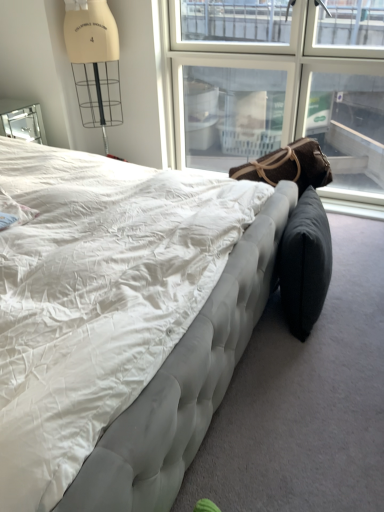
Question: Which direction should I rotate to look at brown fabric bean bag at center, the 1th bean bag chair viewed from the top?

Choices:
 (A) right
 (B) left

Answer: (A)

Question: From a real-world perspective, is brown fabric bean bag at center, the 1th bean bag chair viewed from the top, positioned over tufted fabric bed at center based on gravity?

Choices:
 (A) yes
 (B) no

Answer: (B)

Question: Considering the relative positions of brown fabric bean bag at center, which ranks as the second bean bag chair in bottom-to-top order, and tufted fabric bed at center in the image provided, is brown fabric bean bag at center, which ranks as the second bean bag chair in bottom-to-top order, behind tufted fabric bed at center?

Choices:
 (A) no
 (B) yes

Answer: (B)

Question: Is brown fabric bean bag at center, which ranks as the second bean bag chair in bottom-to-top order, wider than tufted fabric bed at center?

Choices:
 (A) no
 (B) yes

Answer: (A)

Question: Can you confirm if brown fabric bean bag at center, the 1th bean bag chair viewed from the top, is smaller than tufted fabric bed at center?

Choices:
 (A) yes
 (B) no

Answer: (A)

Question: Is brown fabric bean bag at center, the 1th bean bag chair viewed from the top, shorter than tufted fabric bed at center?

Choices:
 (A) no
 (B) yes

Answer: (B)

Question: Is the position of brown fabric bean bag at center, which ranks as the second bean bag chair in bottom-to-top order, less distant than that of tufted fabric bed at center?

Choices:
 (A) yes
 (B) no

Answer: (B)

Question: Can we say transparent glass window at upper right lies outside brown fabric bean bag at center, which ranks as the second bean bag chair in bottom-to-top order?

Choices:
 (A) yes
 (B) no

Answer: (A)

Question: Is the position of transparent glass window at upper right more distant than that of brown fabric bean bag at center, which ranks as the second bean bag chair in bottom-to-top order?

Choices:
 (A) yes
 (B) no

Answer: (A)

Question: Is transparent glass window at upper right wider than brown fabric bean bag at center, which ranks as the second bean bag chair in bottom-to-top order?

Choices:
 (A) no
 (B) yes

Answer: (A)

Question: Is transparent glass window at upper right facing away from brown fabric bean bag at center, which ranks as the second bean bag chair in bottom-to-top order?

Choices:
 (A) yes
 (B) no

Answer: (A)

Question: From the image's perspective, is transparent glass window at upper right below brown fabric bean bag at center, which ranks as the second bean bag chair in bottom-to-top order?

Choices:
 (A) yes
 (B) no

Answer: (B)

Question: Considering the relative positions of transparent glass window at upper right and brown fabric bean bag at center, the 1th bean bag chair viewed from the top, in the image provided, is transparent glass window at upper right to the right of brown fabric bean bag at center, the 1th bean bag chair viewed from the top, from the viewer's perspective?

Choices:
 (A) no
 (B) yes

Answer: (B)

Question: Considering the relative sizes of transparent glass window at upper right and tufted fabric bed at center in the image provided, is transparent glass window at upper right wider than tufted fabric bed at center?

Choices:
 (A) yes
 (B) no

Answer: (B)